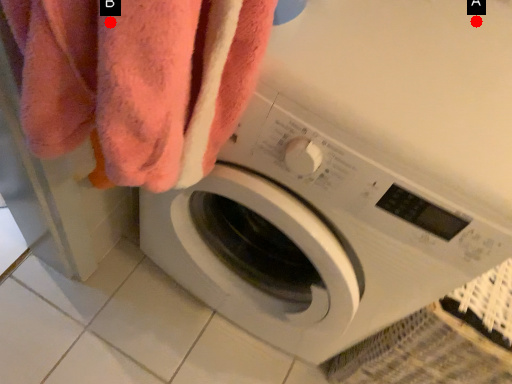
Question: Two points are circled on the image, labeled by A and B beside each circle. Which point is closer to the camera?

Choices:
 (A) A is closer
 (B) B is closer

Answer: (B)